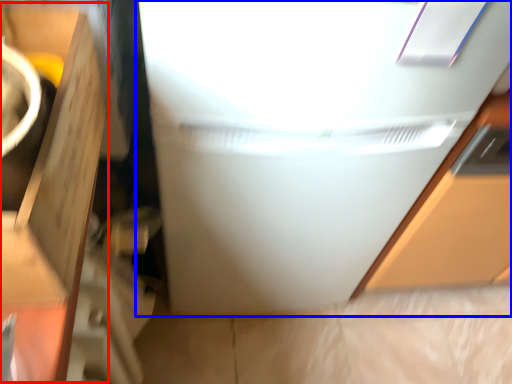
Question: Among these objects, which one is nearest to the camera, cardboard box (highlighted by a red box) or refrigerator (highlighted by a blue box)?

Choices:
 (A) cardboard box
 (B) refrigerator

Answer: (A)